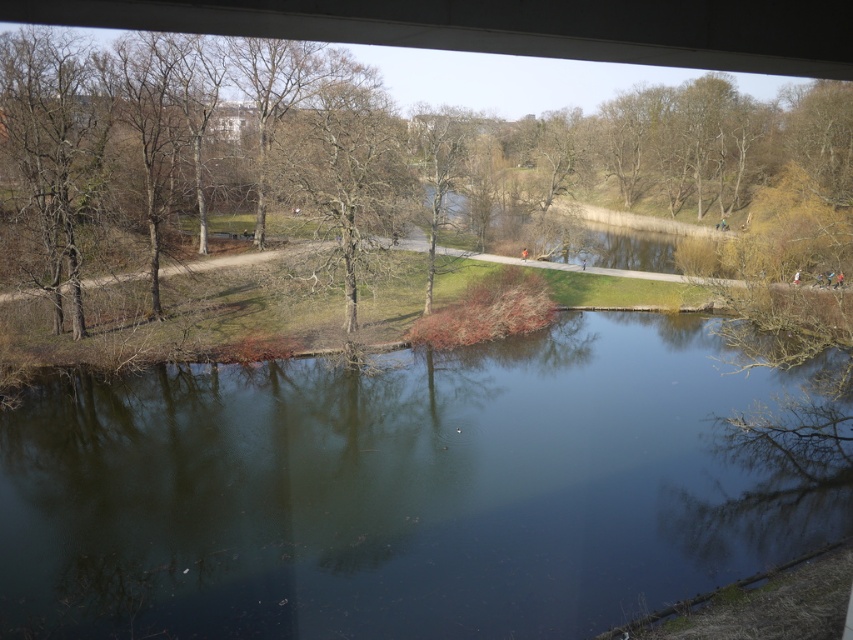
You are standing on the bridge overlooking the park. You see the dark blue water at center and the brown leafless tree at lower left. Which object appears taller in the scene?

The brown leafless tree at lower left appears taller than the dark blue water at center in the scene.

You are a photographer planning to capture the reflection of the bare branches at center in the dark blue water at center. Based on their sizes, which object will occupy more space in your photo?

The dark blue water at center is bigger than the bare branches at center, so it will occupy more space in the photo.

You are a landscape architect designing a new park layout. You need to place a statue that requires a 3m clearance. Given the brown leafless tree at lower left and the bare branches at center, which object allows for the statue to be placed under it without obstruction?

The brown leafless tree at lower left has a greater height compared to the bare branches at center, so placing the statue under the bare branches at center would provide sufficient clearance since it is shorter.